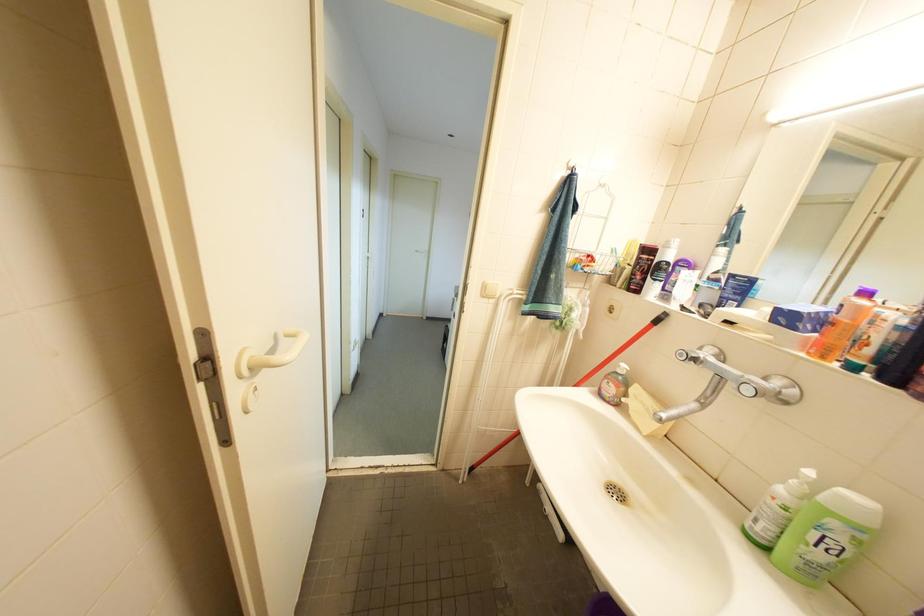
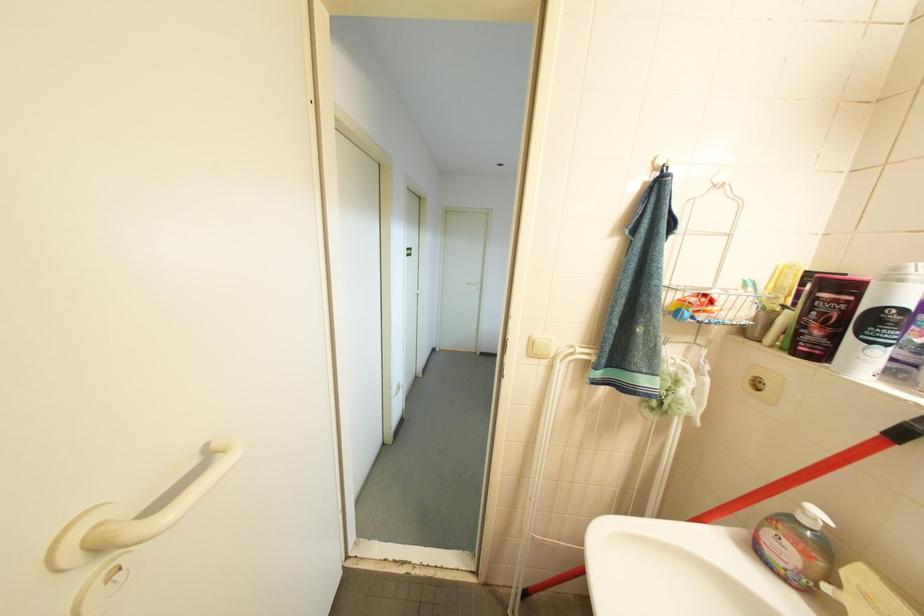
Question: The camera is either moving clockwise (left) or counter-clockwise (right) around the object. The first image is from the beginning of the video and the second image is from the end. Is the camera moving left or right when shooting the video?

Choices:
 (A) Left
 (B) Right

Answer: (B)